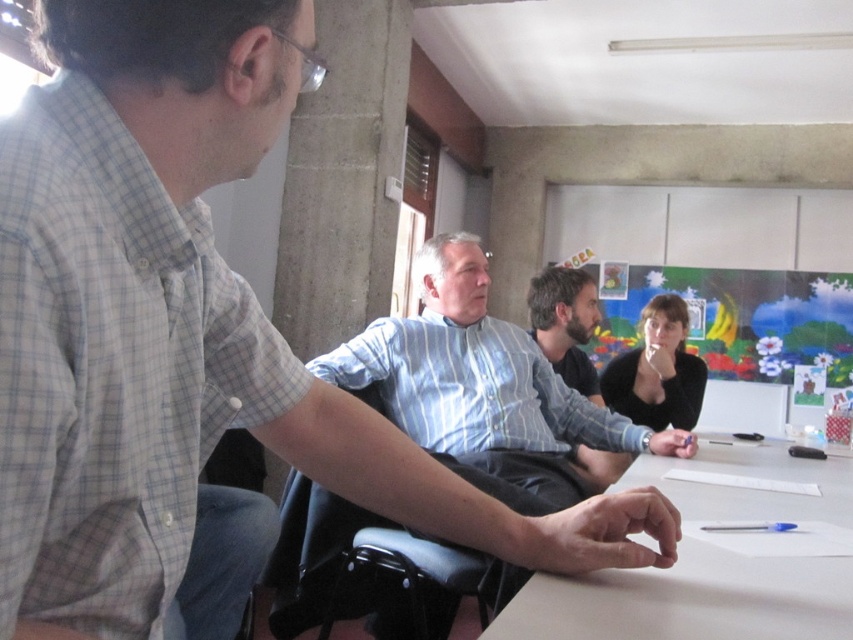
You are a photographer trying to capture a candid shot of the bearded man at center and the black matte shirt at center. Since you want to focus on their faces, which one is positioned higher in the frame?

The bearded man at center is positioned higher than the black matte shirt at center in the frame.

You are a person who wants to sit on the black plastic chair at center. Considering the size of the bearded man at center, will the chair be comfortable for you?

The black plastic chair at center is bigger than the bearded man at center, so it should be comfortable for you to sit on the black plastic chair at center.